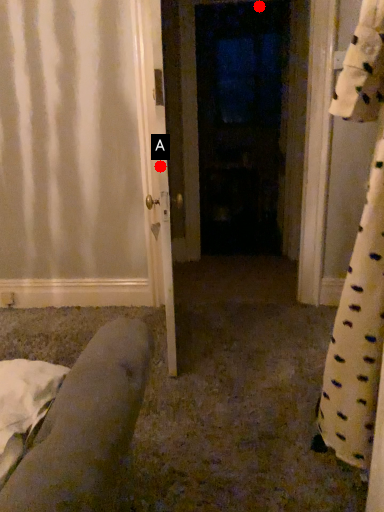
Question: Two points are circled on the image, labeled by A and B beside each circle. Which point appears closest to the camera in this image?

Choices:
 (A) A is closer
 (B) B is closer

Answer: (A)